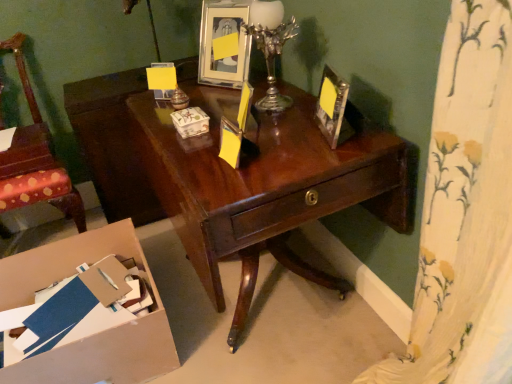
Identify the location of free point in front of silver metallic candle holder at upper right. The image size is (512, 384). (282, 126).